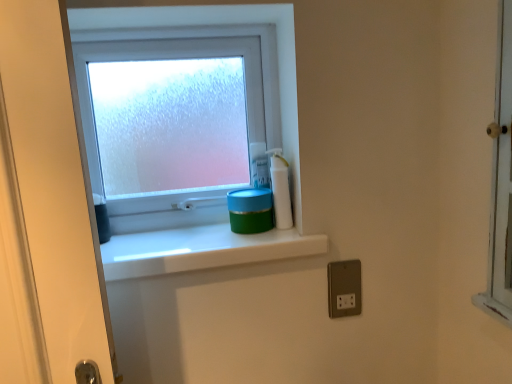
You are a GUI agent. You are given a task and a screenshot of the screen. Output one action in this format:
    pyautogui.click(x=<x>, y=<y>)
    Task: Click on the free space that is to the left of blue plastic container at upper right
    This screenshot has width=512, height=384.
    Given the screenshot: What is the action you would take?
    pyautogui.click(x=196, y=233)